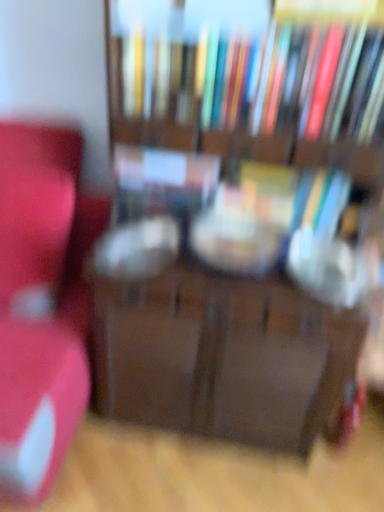
Question: From a real-world perspective, is wooden bookcase at center below matte plastic book at center, which is the second book in top-to-bottom order?

Choices:
 (A) no
 (B) yes

Answer: (B)

Question: Would you say matte plastic book at center, which is the 2th book from bottom to top, is part of wooden bookcase at center's contents?

Choices:
 (A) no
 (B) yes

Answer: (B)

Question: From the image's perspective, is wooden bookcase at center below matte plastic book at center, which is the 2th book from bottom to top?

Choices:
 (A) yes
 (B) no

Answer: (A)

Question: Can you confirm if wooden bookcase at center is smaller than matte plastic book at center, which is the 2th book from bottom to top?

Choices:
 (A) no
 (B) yes

Answer: (A)

Question: From the image's perspective, does wooden bookcase at center appear higher than matte plastic book at center, which is the second book in top-to-bottom order?

Choices:
 (A) yes
 (B) no

Answer: (B)

Question: Does wooden bookcase at center have a lesser width compared to matte plastic book at center, which is the second book in top-to-bottom order?

Choices:
 (A) yes
 (B) no

Answer: (B)

Question: Would you say hardcover book at center, which is the third book from top to bottom, is outside matte plastic book at center, which is the second book in top-to-bottom order?

Choices:
 (A) no
 (B) yes

Answer: (B)

Question: Is hardcover book at center, which is the third book from top to bottom, not near matte plastic book at center, which is the 2th book from bottom to top?

Choices:
 (A) yes
 (B) no

Answer: (B)

Question: From a real-world perspective, is hardcover book at center, arranged as the 1th book when ordered from the bottom, below matte plastic book at center, which is the second book in top-to-bottom order?

Choices:
 (A) no
 (B) yes

Answer: (B)

Question: Is matte plastic book at center, which is the second book in top-to-bottom order, located within hardcover book at center, which is the third book from top to bottom?

Choices:
 (A) no
 (B) yes

Answer: (A)

Question: From the image's perspective, is hardcover book at center, arranged as the 1th book when ordered from the bottom, on top of matte plastic book at center, which is the second book in top-to-bottom order?

Choices:
 (A) yes
 (B) no

Answer: (B)

Question: Is hardcover book at center, which is the third book from top to bottom, to the left of matte plastic book at center, which is the 2th book from bottom to top, from the viewer's perspective?

Choices:
 (A) yes
 (B) no

Answer: (B)

Question: From the image's perspective, does matte red chair at left appear higher than matte plastic book at center, which is the 2th book from bottom to top?

Choices:
 (A) no
 (B) yes

Answer: (A)